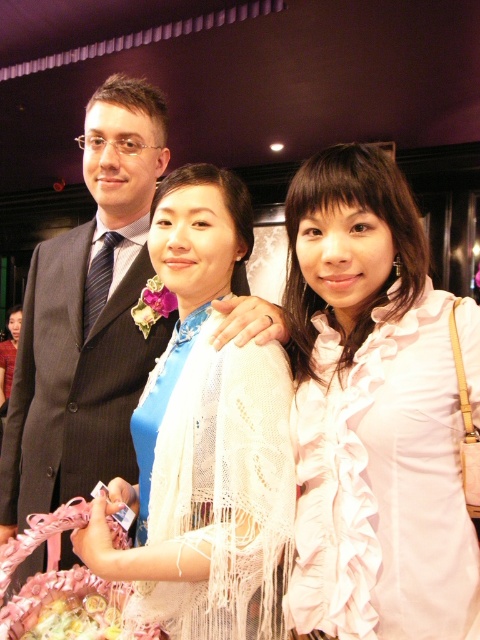
Question: Which point appears farthest from the camera in this image?

Choices:
 (A) (208, 369)
 (B) (24, 454)

Answer: (B)

Question: Does white lace shawl at center appear on the right side of dark blue pinstripe suit at center?

Choices:
 (A) yes
 (B) no

Answer: (A)

Question: Which is farther from the dark blue pinstripe suit at center?

Choices:
 (A) white frilly dress at center
 (B) white lace shawl at center

Answer: (A)

Question: Can you confirm if white lace shawl at center is positioned above dark blue pinstripe suit at center?

Choices:
 (A) no
 (B) yes

Answer: (A)

Question: Considering the real-world distances, which object is closest to the dark blue pinstripe suit at center?

Choices:
 (A) white frilly dress at center
 (B) white lace shawl at center

Answer: (B)

Question: Can you confirm if white lace shawl at center is positioned to the left of dark blue pinstripe suit at center?

Choices:
 (A) no
 (B) yes

Answer: (A)